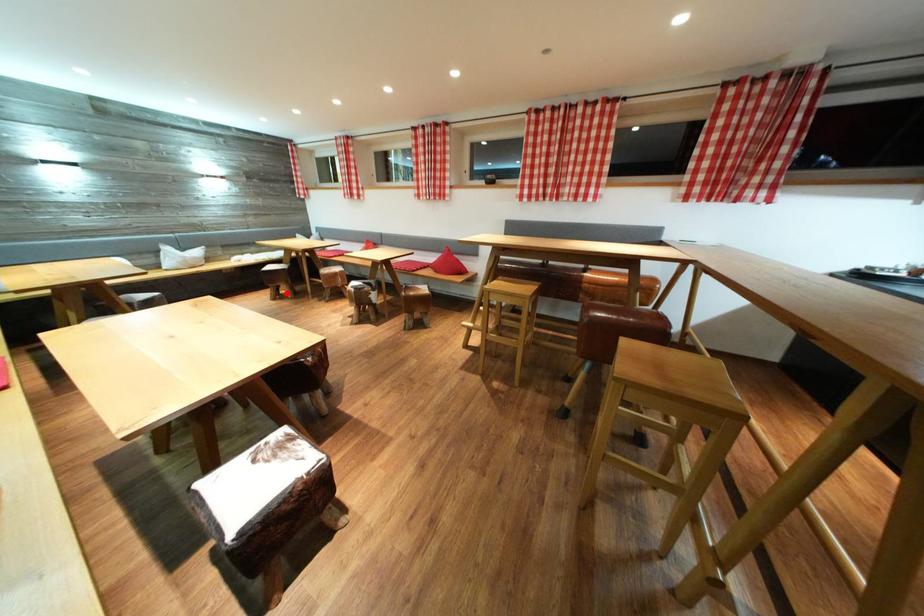
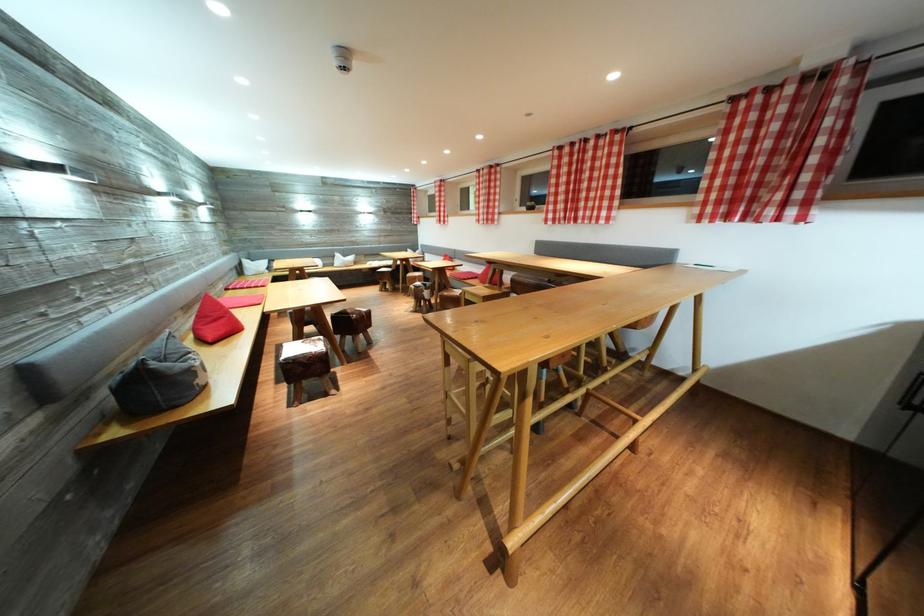
Locate, in the second image, the point that corresponds to the highlighted location in the first image.

(393, 289)